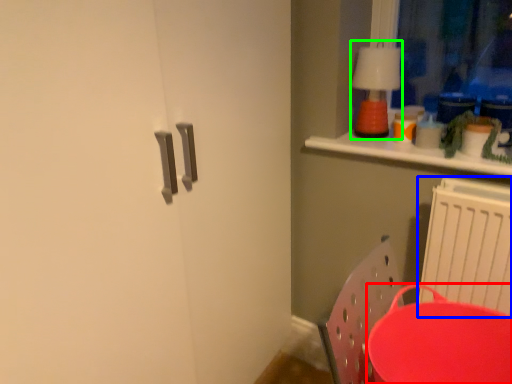
Question: Which is nearer to the round table (highlighted by a red box)? radiator (highlighted by a blue box) or lamp (highlighted by a green box).

Choices:
 (A) radiator
 (B) lamp

Answer: (A)